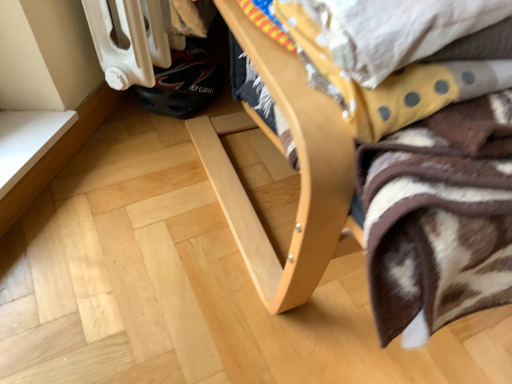
Question: Does natural wood bed frame at center come behind yellow dotted fabric at upper right?

Choices:
 (A) yes
 (B) no

Answer: (B)

Question: From the image's perspective, is natural wood bed frame at center over yellow dotted fabric at upper right?

Choices:
 (A) yes
 (B) no

Answer: (A)

Question: Considering the relative sizes of natural wood bed frame at center and yellow dotted fabric at upper right in the image provided, is natural wood bed frame at center bigger than yellow dotted fabric at upper right?

Choices:
 (A) no
 (B) yes

Answer: (B)

Question: Is natural wood bed frame at center positioned in front of yellow dotted fabric at upper right?

Choices:
 (A) yes
 (B) no

Answer: (A)

Question: Considering the relative positions of natural wood bed frame at center and yellow dotted fabric at upper right in the image provided, is natural wood bed frame at center to the right of yellow dotted fabric at upper right from the viewer's perspective?

Choices:
 (A) no
 (B) yes

Answer: (B)

Question: Is natural wood bed frame at center to the left of yellow dotted fabric at upper right from the viewer's perspective?

Choices:
 (A) yes
 (B) no

Answer: (B)

Question: Is yellow dotted fabric at upper right to the left of natural wood bed frame at center from the viewer's perspective?

Choices:
 (A) yes
 (B) no

Answer: (A)

Question: Can you confirm if yellow dotted fabric at upper right is shorter than natural wood bed frame at center?

Choices:
 (A) yes
 (B) no

Answer: (A)

Question: Is yellow dotted fabric at upper right taller than natural wood bed frame at center?

Choices:
 (A) no
 (B) yes

Answer: (A)

Question: Are yellow dotted fabric at upper right and natural wood bed frame at center making contact?

Choices:
 (A) no
 (B) yes

Answer: (A)

Question: Can we say yellow dotted fabric at upper right lies outside natural wood bed frame at center?

Choices:
 (A) yes
 (B) no

Answer: (B)

Question: Is yellow dotted fabric at upper right wider than natural wood bed frame at center?

Choices:
 (A) yes
 (B) no

Answer: (B)

Question: Considering the relative positions of natural wood bed frame at center and yellow dotted fabric at upper right in the image provided, is natural wood bed frame at center to the left or to the right of yellow dotted fabric at upper right?

Choices:
 (A) left
 (B) right

Answer: (B)